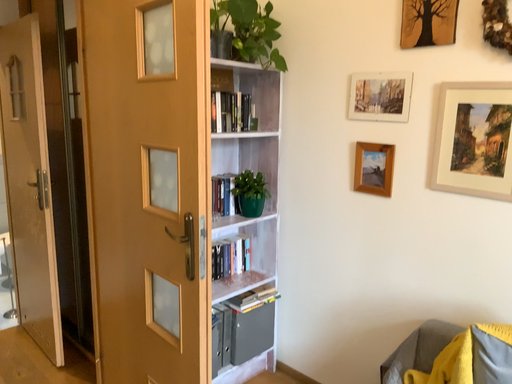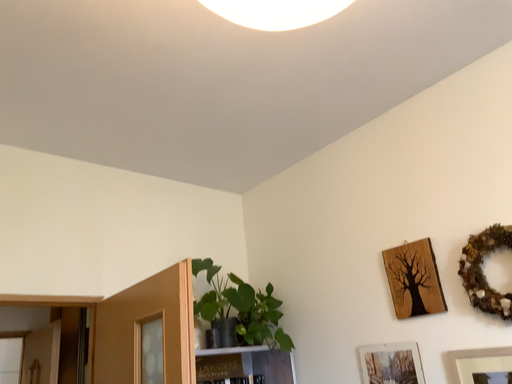
Question: Which way did the camera rotate in the video?

Choices:
 (A) rotated left
 (B) rotated right

Answer: (A)